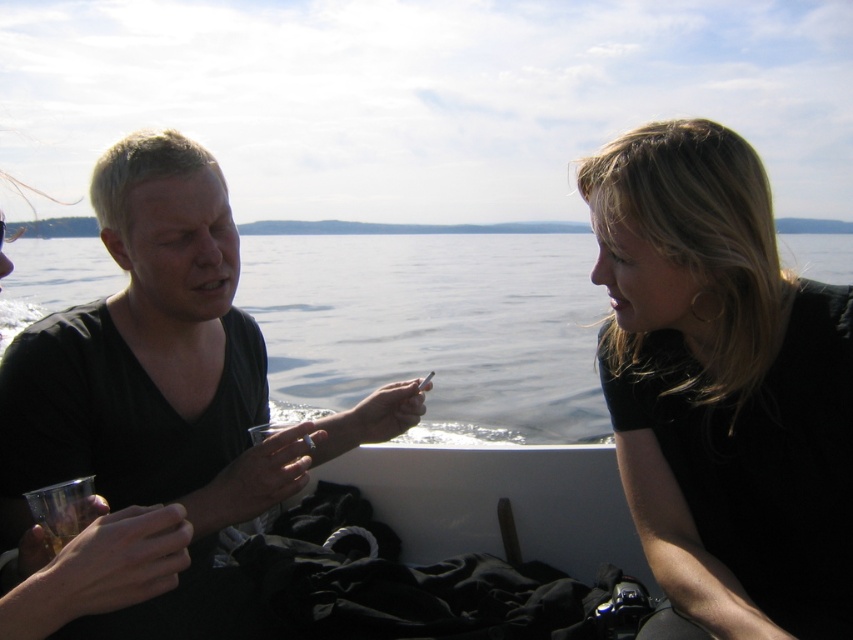
In the scene shown: Can you confirm if black matte shirt at left is positioned above transparent water at center?

Actually, black matte shirt at left is below transparent water at center.

Who is positioned more to the right, black matte shirt at left or transparent water at center?

Positioned to the right is transparent water at center.

Which is in front, point (173, 390) or point (544, 280)?

Point (173, 390)

Where is `black matte shirt at left`? The image size is (853, 640). black matte shirt at left is located at coordinates (164, 365).

Is black matte hair at upper right taller than transparent water at center?

Incorrect, black matte hair at upper right's height is not larger of transparent water at center's.

Is point (740, 305) positioned in front of point (519, 364)?

Yes, it is in front of point (519, 364).

Find the location of `black matte hair at upper right`. black matte hair at upper right is located at coordinates (723, 387).

From the picture: Between black matte hair at upper right and black matte shirt at left, which one has more height?

With more height is black matte shirt at left.

Looking at this image, can you confirm if black matte hair at upper right is bigger than black matte shirt at left?

Incorrect, black matte hair at upper right is not larger than black matte shirt at left.

You are a GUI agent. You are given a task and a screenshot of the screen. Output one action in this format:
    pyautogui.click(x=<x>, y=<y>)
    Task: Click on the black matte hair at upper right
    This screenshot has height=640, width=853.
    Given the screenshot: What is the action you would take?
    pyautogui.click(x=723, y=387)

Where is `black matte hair at upper right`? black matte hair at upper right is located at coordinates (723, 387).